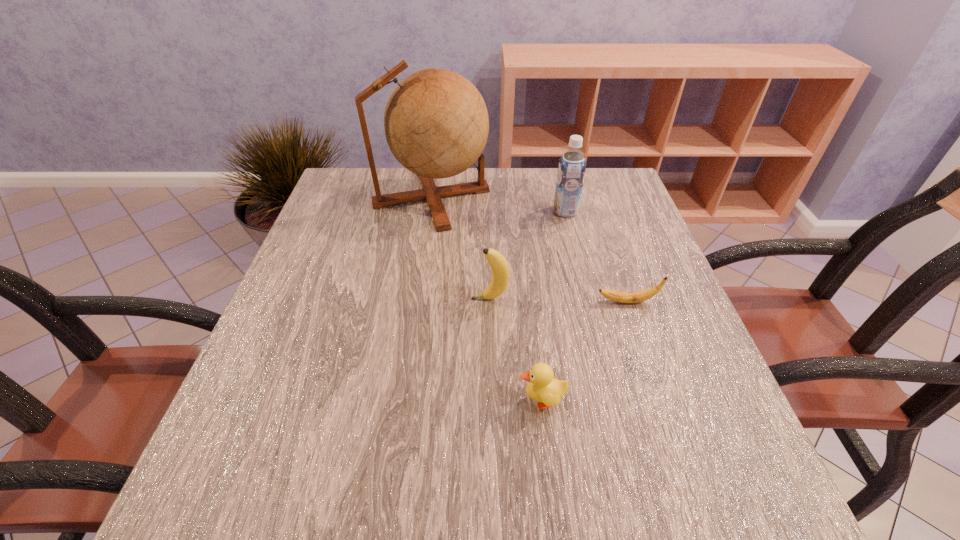
You are a GUI agent. You are given a task and a screenshot of the screen. Output one action in this format:
    pyautogui.click(x=<x>, y=<y>)
    Task: Click on the free space located on the label of the second tallest object
    The width and height of the screenshot is (960, 540).
    Given the screenshot: What is the action you would take?
    pyautogui.click(x=475, y=211)

You are a GUI agent. You are given a task and a screenshot of the screen. Output one action in this format:
    pyautogui.click(x=<x>, y=<y>)
    Task: Click on the vacant space located 0.400m on the label of the second tallest object
    Image resolution: width=960 pixels, height=540 pixels.
    Given the screenshot: What is the action you would take?
    pyautogui.click(x=397, y=211)

The width and height of the screenshot is (960, 540). What are the coordinates of `free region located from the stem of the taller banana` in the screenshot? It's located at (334, 299).

The height and width of the screenshot is (540, 960). I want to click on free location located 0.340m from the stem of the taller banana, so click(304, 299).

This screenshot has height=540, width=960. I want to click on vacant space located from the stem of the taller banana, so click(x=403, y=299).

Image resolution: width=960 pixels, height=540 pixels. I want to click on vacant space located on the front-facing side of the nearest object, so click(x=403, y=400).

The image size is (960, 540). I want to click on vacant space located 0.140m on the front-facing side of the nearest object, so click(433, 400).

Find the location of a particular element. free space located 0.090m on the front-facing side of the nearest object is located at coordinates (464, 400).

The image size is (960, 540). Find the location of `vacant space located 0.240m on the peel of the shorter banana from the top`. vacant space located 0.240m on the peel of the shorter banana from the top is located at coordinates (478, 302).

The height and width of the screenshot is (540, 960). What are the coordinates of `vacant position located 0.160m on the peel of the shorter banana from the top` in the screenshot? It's located at (517, 302).